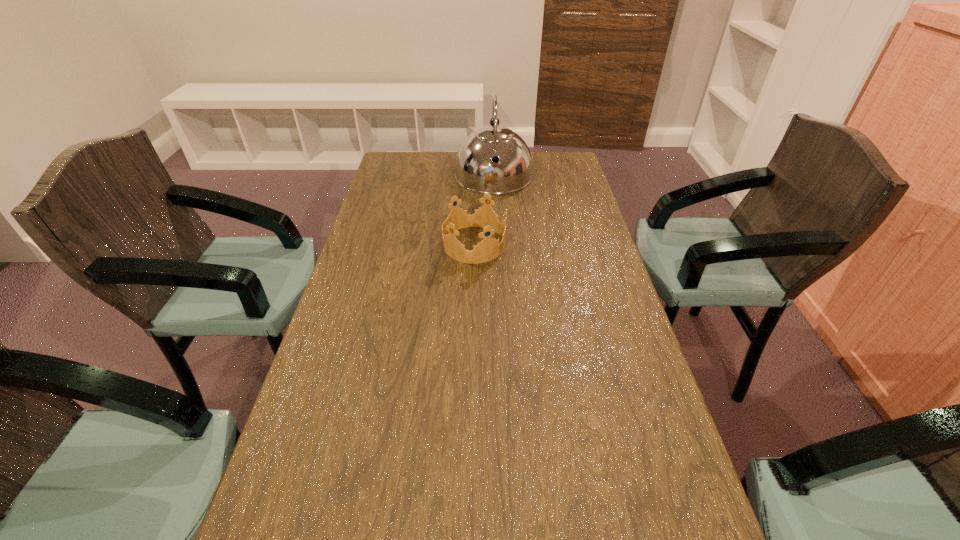
This screenshot has width=960, height=540. Identify the location of vacant space at the far left corner of the desktop. (407, 166).

The image size is (960, 540). Find the location of `free space at the far right corner of the desktop`. free space at the far right corner of the desktop is located at coordinates (575, 171).

What are the coordinates of `blank area in the image that satisfies the following two spatial constraints: 1. from the spout of the farther object; 2. on the front-facing side of the nearer object` in the screenshot? It's located at (497, 244).

Where is `free space that satisfies the following two spatial constraints: 1. from the spout of the kettle; 2. on the front-facing side of the nearer object`? The image size is (960, 540). free space that satisfies the following two spatial constraints: 1. from the spout of the kettle; 2. on the front-facing side of the nearer object is located at coordinates (497, 244).